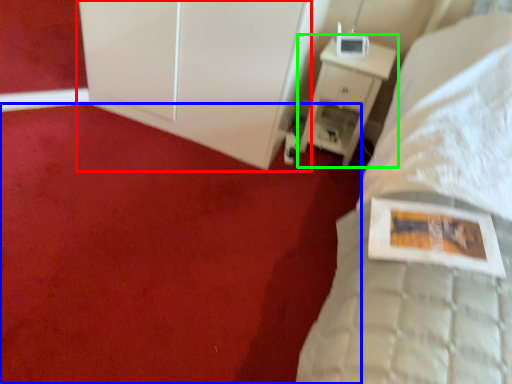
Question: Which object is positioned closest to dresser (highlighted by a red box)? Select from plain (highlighted by a blue box) and nightstand (highlighted by a green box).

Choices:
 (A) plain
 (B) nightstand

Answer: (B)